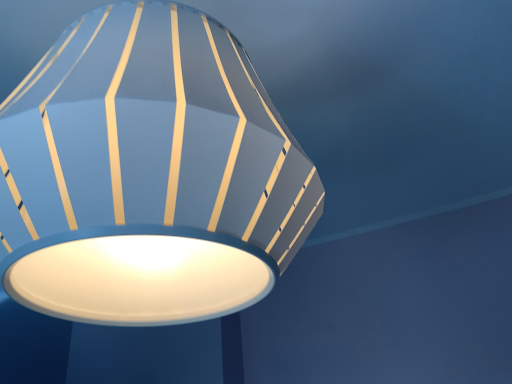
Locate an element on the screen. The height and width of the screenshot is (384, 512). satin white lampshade at center is located at coordinates (143, 200).

What is the approximate width of satin white lampshade at center?

satin white lampshade at center is 21.67 inches wide.

The height and width of the screenshot is (384, 512). Describe the element at coordinates (143, 200) in the screenshot. I see `satin white lampshade at center` at that location.

Identify the location of satin white lampshade at center. Image resolution: width=512 pixels, height=384 pixels. (143, 200).